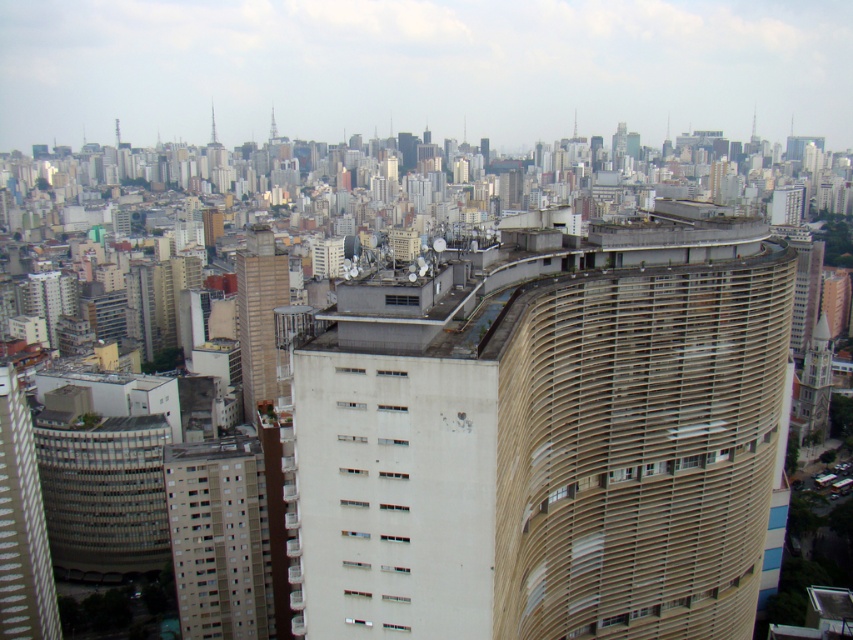
Question: Is beige concrete building at lower left to the left of white textured building at left from the viewer's perspective?

Choices:
 (A) no
 (B) yes

Answer: (A)

Question: Which is farther from the beige concrete building at center?

Choices:
 (A) beige textured building at center
 (B) white textured building at left
 (C) beige concrete building at lower left

Answer: (A)

Question: Which point is farther to the camera?

Choices:
 (A) (274, 364)
 (B) (216, 561)
 (C) (677, 598)
 (D) (47, 605)

Answer: (A)

Question: Among these objects, which one is nearest to the camera?

Choices:
 (A) beige textured building at center
 (B) beige concrete building at center

Answer: (A)

Question: Is beige concrete building at lower left positioned in front of white textured building at left?

Choices:
 (A) yes
 (B) no

Answer: (B)

Question: Considering the relative positions of beige concrete building at lower left and white textured building at left in the image provided, where is beige concrete building at lower left located with respect to white textured building at left?

Choices:
 (A) left
 (B) right

Answer: (B)